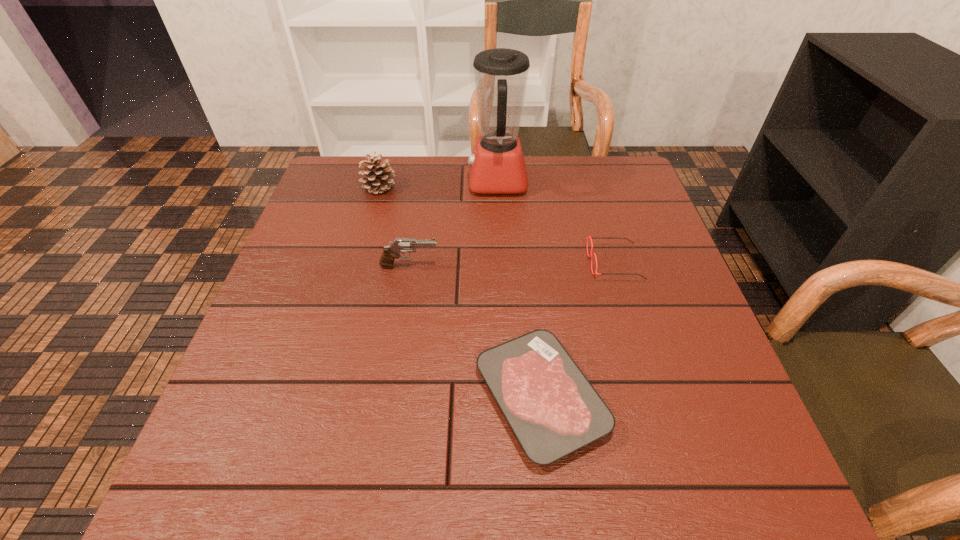
Locate an element on the screen. This screenshot has height=540, width=960. the tallest object is located at coordinates (497, 166).

Where is `the second tallest object`? Image resolution: width=960 pixels, height=540 pixels. the second tallest object is located at coordinates (379, 175).

At what (x,y) coordinates should I click in order to perform the action: click on pinecone. Please return your answer as a coordinate pair (x, y). Looking at the image, I should click on (379, 175).

I want to click on the fourth object from right to left, so click(400, 245).

You are a GUI agent. You are given a task and a screenshot of the screen. Output one action in this format:
    pyautogui.click(x=<x>, y=<y>)
    Task: Click on the third tallest object
    This screenshot has width=960, height=540.
    Given the screenshot: What is the action you would take?
    pyautogui.click(x=400, y=245)

Where is `the rightmost object`? This screenshot has height=540, width=960. the rightmost object is located at coordinates (591, 255).

Where is `spectacles`? This screenshot has height=540, width=960. spectacles is located at coordinates (591, 255).

Where is `steak`? This screenshot has width=960, height=540. steak is located at coordinates (553, 410).

Find the location of a particular element. This screenshot has width=960, height=540. the shortest object is located at coordinates (553, 410).

The width and height of the screenshot is (960, 540). Identify the location of vacant region located 0.200m on the front of the tallest object near the controls. (398, 182).